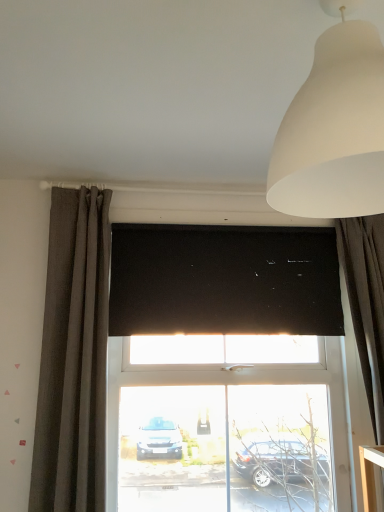
Question: Is white matte lampshade at upper right at the back of dark gray textured curtain at left, the 1th curtain viewed from the left?

Choices:
 (A) yes
 (B) no

Answer: (B)

Question: Is white matte lampshade at upper right located within dark gray textured curtain at left, positioned as the 2th curtain in right-to-left order?

Choices:
 (A) yes
 (B) no

Answer: (B)

Question: Is dark gray textured curtain at left, the 1th curtain viewed from the left, bigger than white matte lampshade at upper right?

Choices:
 (A) yes
 (B) no

Answer: (A)

Question: From a real-world perspective, is dark gray textured curtain at left, positioned as the 2th curtain in right-to-left order, on top of white matte lampshade at upper right?

Choices:
 (A) yes
 (B) no

Answer: (B)

Question: Is dark gray textured curtain at left, positioned as the 2th curtain in right-to-left order, to the left of white matte lampshade at upper right from the viewer's perspective?

Choices:
 (A) yes
 (B) no

Answer: (A)

Question: Considering the positions of point (74, 401) and point (271, 273), is point (74, 401) closer or farther from the camera than point (271, 273)?

Choices:
 (A) farther
 (B) closer

Answer: (B)

Question: Relative to black matte window screen at center, is dark gray textured curtain at left, positioned as the 2th curtain in right-to-left order, in front or behind?

Choices:
 (A) behind
 (B) front

Answer: (B)

Question: Based on their positions, is dark gray textured curtain at left, the 1th curtain viewed from the left, located to the left or right of black matte window screen at center?

Choices:
 (A) left
 (B) right

Answer: (A)

Question: Looking at their shapes, would you say dark gray textured curtain at left, the 1th curtain viewed from the left, is wider or thinner than black matte window screen at center?

Choices:
 (A) thin
 (B) wide

Answer: (B)

Question: Is white matte lampshade at upper right to the left or to the right of dark gray textured curtain at left, the 1th curtain viewed from the left, in the image?

Choices:
 (A) left
 (B) right

Answer: (B)

Question: In terms of height, does white matte lampshade at upper right look taller or shorter compared to dark gray textured curtain at left, the 1th curtain viewed from the left?

Choices:
 (A) tall
 (B) short

Answer: (B)

Question: From a real-world perspective, relative to dark gray textured curtain at left, the 1th curtain viewed from the left, is white matte lampshade at upper right vertically above or below?

Choices:
 (A) below
 (B) above

Answer: (B)

Question: Based on their sizes in the image, would you say white matte lampshade at upper right is bigger or smaller than dark gray textured curtain at left, positioned as the 2th curtain in right-to-left order?

Choices:
 (A) small
 (B) big

Answer: (A)

Question: Is black matte window screen at center inside the boundaries of dark gray textured curtain at left, positioned as the 2th curtain in right-to-left order, or outside?

Choices:
 (A) inside
 (B) outside

Answer: (B)

Question: Is black matte window screen at center to the left or to the right of dark gray textured curtain at left, the 1th curtain viewed from the left, in the image?

Choices:
 (A) right
 (B) left

Answer: (A)